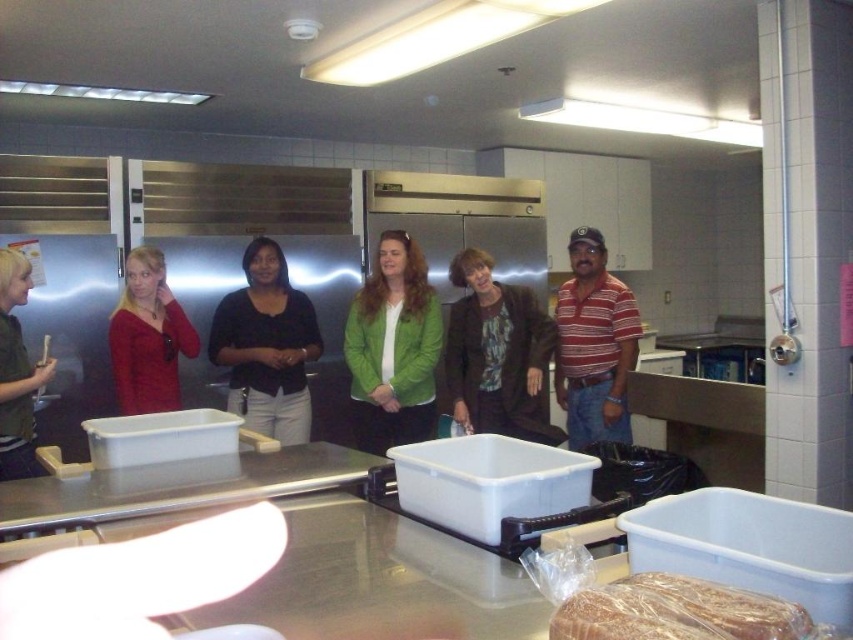
Can you confirm if green matte jacket at center is positioned above matte red sweater at left?

No, green matte jacket at center is not above matte red sweater at left.

Is green matte jacket at center in front of matte red sweater at left?

No, green matte jacket at center is further to the viewer.

Locate an element on the screen. green matte jacket at center is located at coordinates (393, 348).

Locate an element on the screen. The image size is (853, 640). green matte jacket at center is located at coordinates (393, 348).

Is point (408, 308) farther from viewer compared to point (3, 312)?

Yes, it is.

Does green matte jacket at center have a greater width compared to matte green shirt at left?

Indeed, green matte jacket at center has a greater width compared to matte green shirt at left.

Is point (363, 307) farther from viewer compared to point (32, 429)?

Yes.

Locate an element on the screen. The height and width of the screenshot is (640, 853). green matte jacket at center is located at coordinates (393, 348).

Can you confirm if matte black shirt at center is smaller than matte green shirt at left?

Actually, matte black shirt at center might be larger than matte green shirt at left.

Who is taller, matte black shirt at center or matte green shirt at left?

Standing taller between the two is matte black shirt at center.

Is point (263, 404) positioned after point (9, 310)?

Yes, point (263, 404) is behind point (9, 310).

Find the location of `matte black shirt at center`. matte black shirt at center is located at coordinates (265, 346).